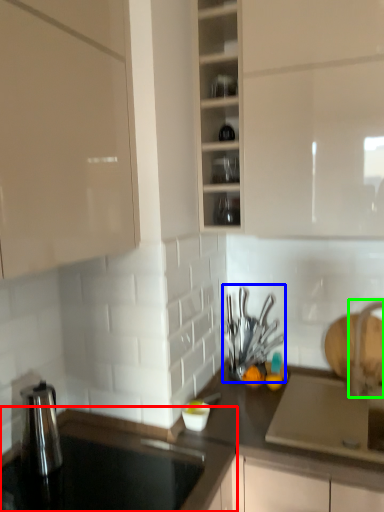
Question: Estimate the real-world distances between objects in this image. Which object is farther from countertop (highlighted by a red box), tableware (highlighted by a blue box) or faucet (highlighted by a green box)?

Choices:
 (A) tableware
 (B) faucet

Answer: (B)